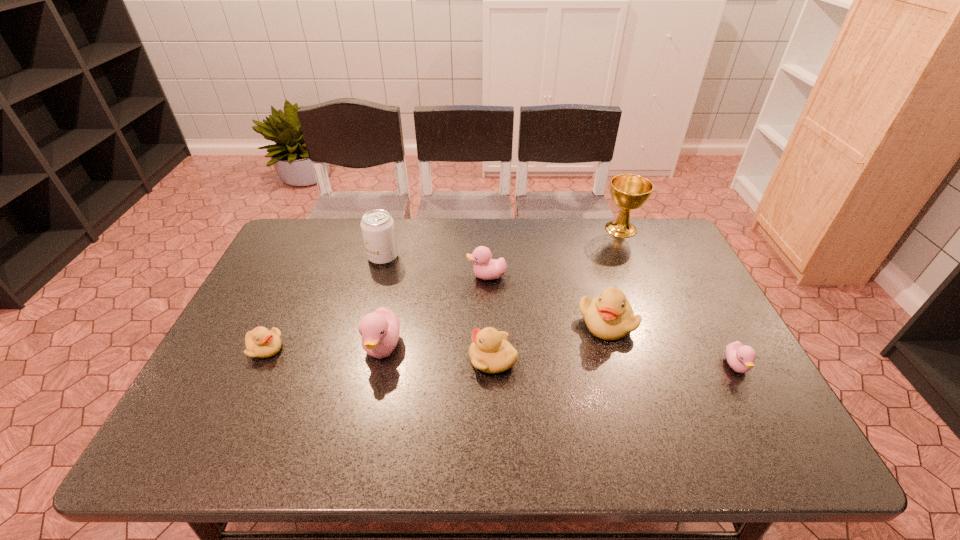
Locate an element on the screen. The height and width of the screenshot is (540, 960). yellow duckling that is the second closest to the sixth object from left to right is located at coordinates (260, 342).

Identify the location of vacant space that satisfies the following two spatial constraints: 1. on the front-facing side of the biggest pink duckling; 2. on the beak of the leftmost duckling. The height and width of the screenshot is (540, 960). (383, 349).

The height and width of the screenshot is (540, 960). Find the location of `free space that satisfies the following two spatial constraints: 1. on the front-facing side of the biggest pink duckling; 2. on the beak of the leftmost object`. free space that satisfies the following two spatial constraints: 1. on the front-facing side of the biggest pink duckling; 2. on the beak of the leftmost object is located at coordinates (383, 349).